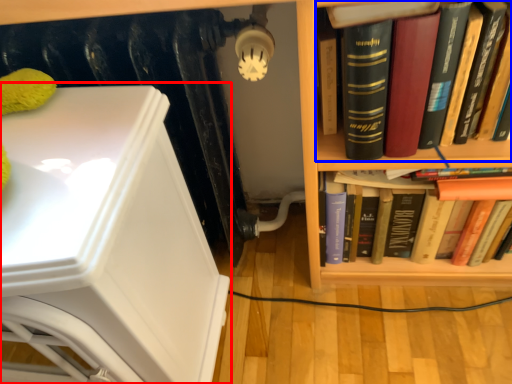
Question: Which of the following is the closest to the observer, armchair (highlighted by a red box) or book (highlighted by a blue box)?

Choices:
 (A) armchair
 (B) book

Answer: (A)